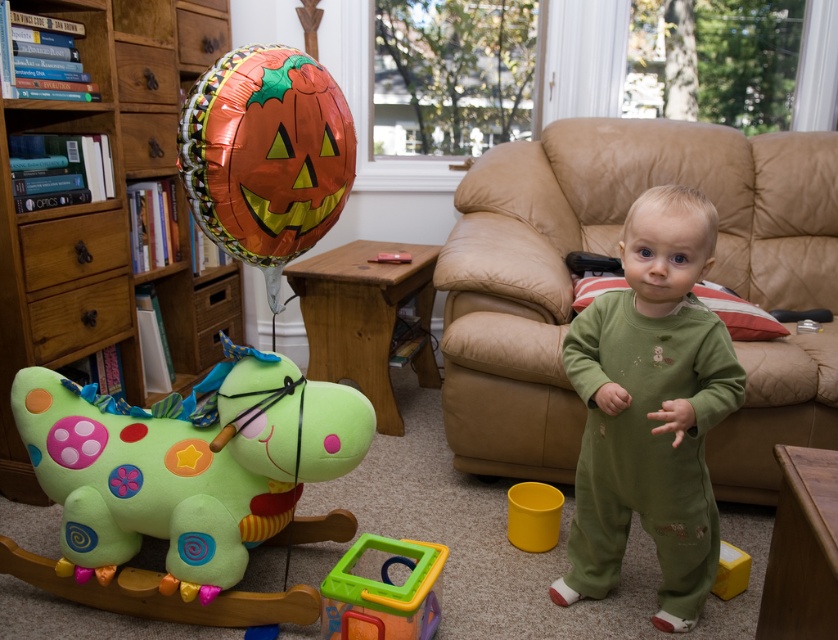
You are a parent trying to clean up the living room. You see the green soft onesie at center and the translucent plastic cube at lower center. Which object is closer to the floor?

The translucent plastic cube at lower center is closer to the floor because the green soft onesie at center is located above it.

You are a parent trying to decide which item to put in the toy box first. The soft plush horse at left and the green soft onesie at center are both in sight. Which one is smaller and should be placed first?

The soft plush horse at left is smaller than the green soft onesie at center, so it should be placed first.